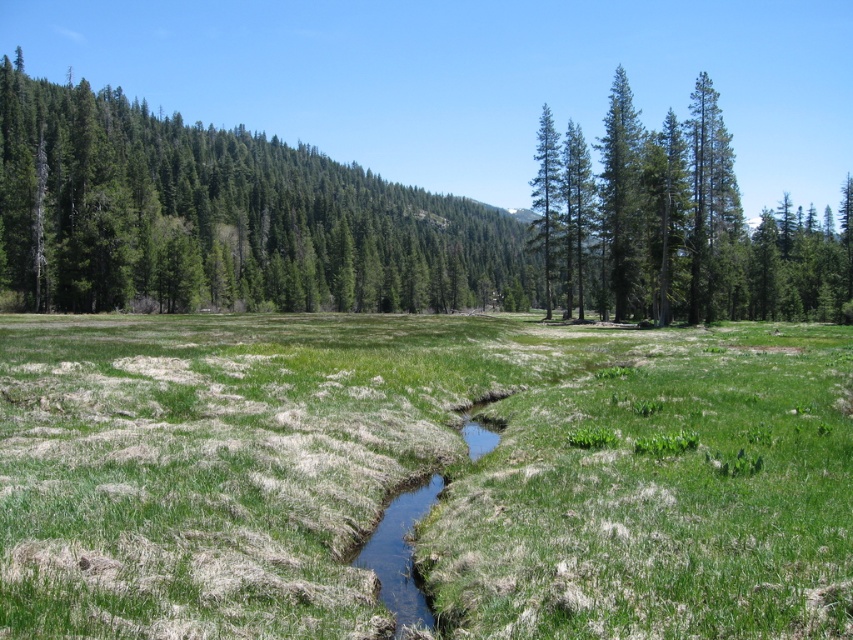
Who is taller, green matte tree at left or clear water stream at center?

Standing taller between the two is green matte tree at left.

Does green matte tree at left come in front of clear water stream at center?

No, green matte tree at left is further to the viewer.

In order to click on green matte tree at left in this screenshot , I will do `click(223, 220)`.

You are a GUI agent. You are given a task and a screenshot of the screen. Output one action in this format:
    pyautogui.click(x=<x>, y=<y>)
    Task: Click on the green matte tree at upper right
    Image resolution: width=853 pixels, height=640 pixels.
    Given the screenshot: What is the action you would take?
    pyautogui.click(x=682, y=225)

Between green grass at center and green matte tree at center, which one has more height?

A: With more height is green matte tree at center.

The height and width of the screenshot is (640, 853). Identify the location of green grass at center. (421, 476).

Is point (181, 352) in front of point (548, 122)?

That is True.

You are a GUI agent. You are given a task and a screenshot of the screen. Output one action in this format:
    pyautogui.click(x=<x>, y=<y>)
    Task: Click on the green grass at center
    The image size is (853, 640).
    Given the screenshot: What is the action you would take?
    pyautogui.click(x=421, y=476)